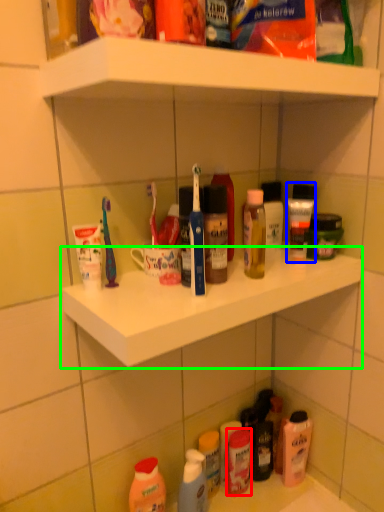
Question: Which object is positioned farthest from toiletry (highlighted by a red box)? Select from toiletry (highlighted by a blue box) and ledge (highlighted by a green box).

Choices:
 (A) toiletry
 (B) ledge

Answer: (A)